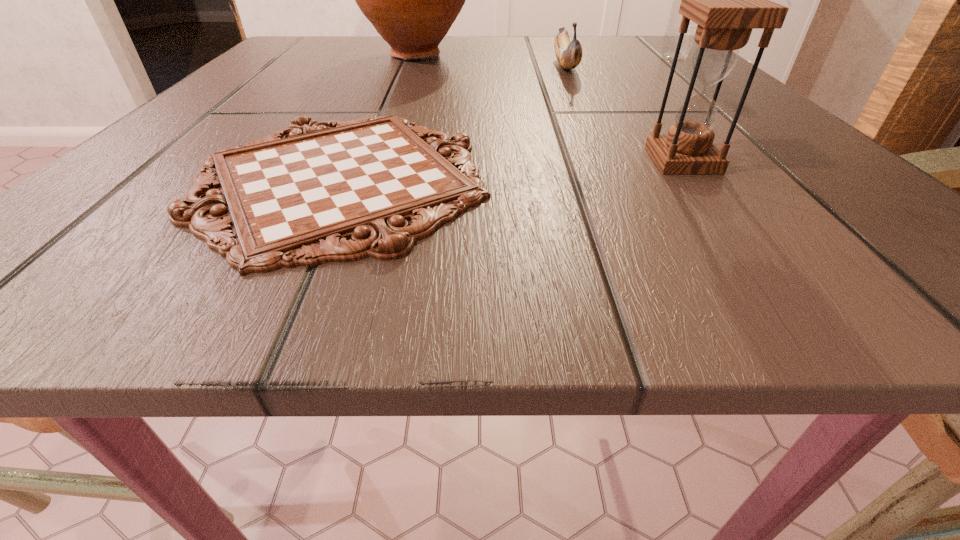
Where is `vacant space situated 0.380m at the stem of the banana`? vacant space situated 0.380m at the stem of the banana is located at coordinates (634, 205).

The image size is (960, 540). I want to click on vacant space located 0.110m on the back of the shortest object, so click(x=382, y=92).

Locate an element on the screen. This screenshot has width=960, height=540. pottery at the far edge is located at coordinates (412, 0).

Locate an element on the screen. water bottle at the far edge is located at coordinates (671, 36).

Where is `banana located at the far edge`? The image size is (960, 540). banana located at the far edge is located at coordinates (569, 54).

In order to click on object that is at the near edge in this screenshot , I will do `click(294, 198)`.

Locate an element on the screen. This screenshot has height=540, width=960. object positioned at the left edge is located at coordinates (294, 198).

In order to click on water bottle that is at the right edge in this screenshot , I will do click(x=671, y=36).

Where is `hourglass that is at the right edge`? The height and width of the screenshot is (540, 960). hourglass that is at the right edge is located at coordinates (727, 0).

You are a GUI agent. You are given a task and a screenshot of the screen. Output one action in this format:
    pyautogui.click(x=<x>, y=<y>)
    Task: Click on the object positioned at the near left corner
    
    Given the screenshot: What is the action you would take?
    [x=294, y=198]